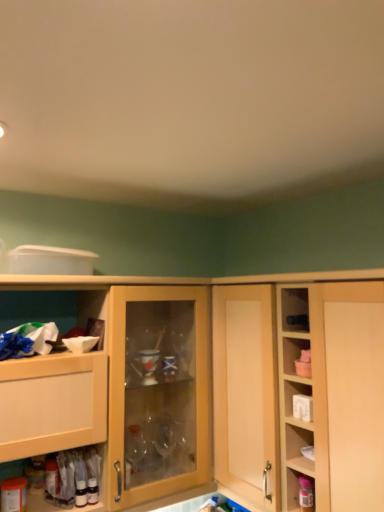
Question: From a real-world perspective, relative to matte plastic container at lower right, is white plastic plug at upper right vertically above or below?

Choices:
 (A) below
 (B) above

Answer: (B)

Question: Based on their positions, is white plastic plug at upper right located to the left or right of matte plastic container at lower right?

Choices:
 (A) right
 (B) left

Answer: (A)

Question: Which is nearer to the light wood cabinet at center, which is the 2th cabinetry in left-to-right order?

Choices:
 (A) matte plastic container at lower right
 (B) white plastic plug at upper right
 (C) light wood cabinet at left, placed as the 2th cabinetry when sorted from right to left

Answer: (B)

Question: Estimate the real-world distances between objects in this image. Which object is farther from the light wood cabinet at left, the 1th cabinetry viewed from the left?

Choices:
 (A) white plastic plug at upper right
 (B) light wood cabinet at center, which is the 2th cabinetry in left-to-right order
 (C) matte plastic container at lower right

Answer: (C)